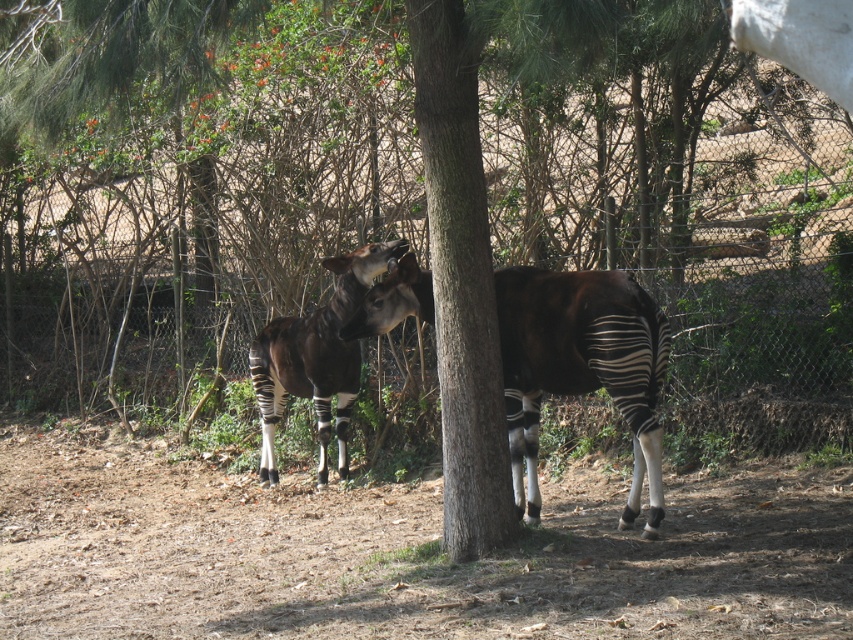
Question: Does dark brown glossy okapi at center have a lesser width compared to black and white striped okapi at center?

Choices:
 (A) no
 (B) yes

Answer: (B)

Question: Estimate the real-world distances between objects in this image. Which object is closer to the brown rough tree trunk at center?

Choices:
 (A) black and white striped okapi at center
 (B) dark brown glossy okapi at center

Answer: (B)

Question: From the image, what is the correct spatial relationship of brown rough tree trunk at center in relation to dark brown glossy okapi at center?

Choices:
 (A) below
 (B) above

Answer: (B)

Question: Considering the real-world distances, which object is closest to the black and white striped okapi at center?

Choices:
 (A) dark brown glossy okapi at center
 (B) brown rough tree trunk at center

Answer: (A)

Question: Is brown rough tree trunk at center bigger than dark brown glossy okapi at center?

Choices:
 (A) yes
 (B) no

Answer: (A)

Question: Estimate the real-world distances between objects in this image. Which object is closer to the brown rough tree trunk at center?

Choices:
 (A) black and white striped okapi at center
 (B) dark brown glossy okapi at center

Answer: (B)